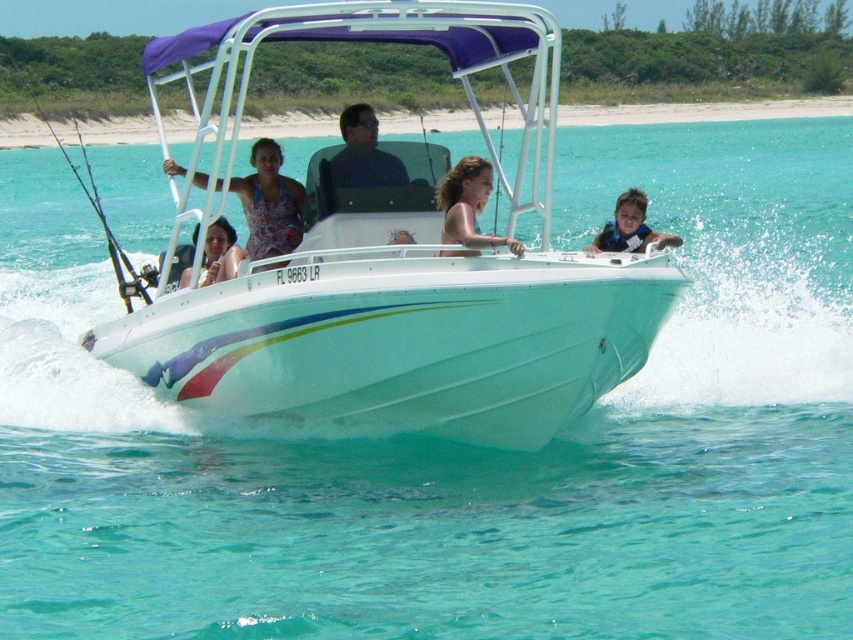
Question: Observing the image, what is the correct spatial positioning of blue life vest at center in reference to matte pink dress at center?

Choices:
 (A) below
 (B) above

Answer: (B)

Question: Which of these objects is positioned farthest from the matte pink dress at center?

Choices:
 (A) matte floral dress at center
 (B) matte black shirt at center
 (C) white glossy boat at center
 (D) matte pink swimsuit at center

Answer: (D)

Question: Which object is farther from the camera taking this photo?

Choices:
 (A) matte black shirt at center
 (B) matte pink dress at center

Answer: (B)

Question: Is the position of matte pink swimsuit at center more distant than that of matte pink dress at center?

Choices:
 (A) no
 (B) yes

Answer: (A)

Question: Does matte floral dress at center come in front of matte black shirt at center?

Choices:
 (A) no
 (B) yes

Answer: (B)

Question: Which object is the closest to the matte black shirt at center?

Choices:
 (A) blue life vest at center
 (B) white glossy boat at center
 (C) matte pink swimsuit at center
 (D) matte pink dress at center

Answer: (C)